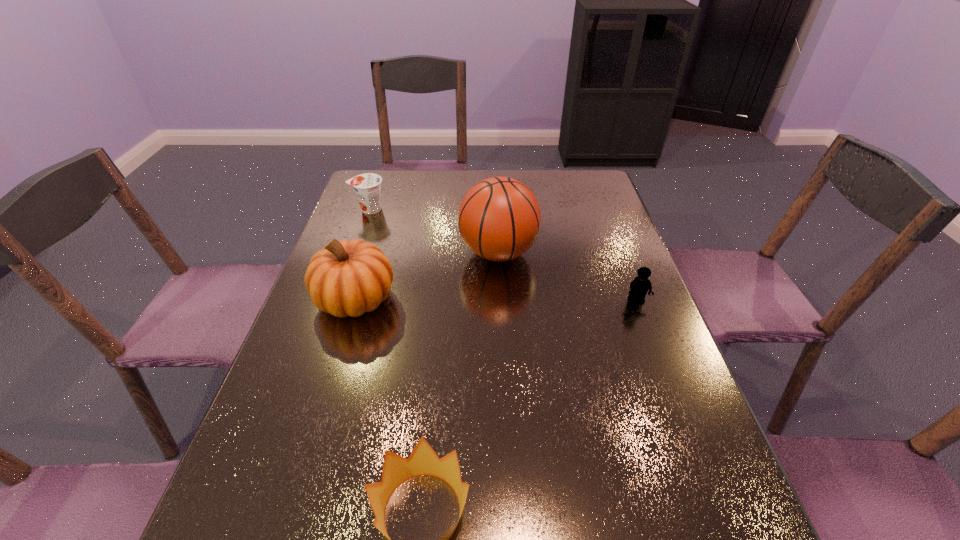
Find the location of a particular element. This screenshot has width=960, height=540. yogurt at the left edge is located at coordinates (367, 186).

Locate an element on the screen. This screenshot has height=540, width=960. object at the right edge is located at coordinates (640, 285).

Locate an element on the screen. Image resolution: width=960 pixels, height=540 pixels. object located at the far left corner is located at coordinates (367, 186).

This screenshot has height=540, width=960. In the image, there is a desktop. Identify the location of vacant region at the far edge. (524, 181).

In the image, there is a desktop. Where is `free space at the left edge`? free space at the left edge is located at coordinates (376, 223).

The width and height of the screenshot is (960, 540). I want to click on free space at the right edge of the desktop, so click(624, 328).

What are the coordinates of `free space between the tallest object and the yogurt` in the screenshot? It's located at (434, 231).

Where is `free space between the pumpkin and the basketball`? free space between the pumpkin and the basketball is located at coordinates (427, 276).

You are a GUI agent. You are given a task and a screenshot of the screen. Output one action in this format:
    pyautogui.click(x=<x>, y=<y>)
    Task: Click on the empty space that is in between the basketball and the rightmost object
    Image resolution: width=960 pixels, height=540 pixels.
    Given the screenshot: What is the action you would take?
    pyautogui.click(x=567, y=277)

Locate an element on the screen. The image size is (960, 540). object that is the fourth closest to the farthest object is located at coordinates (423, 460).